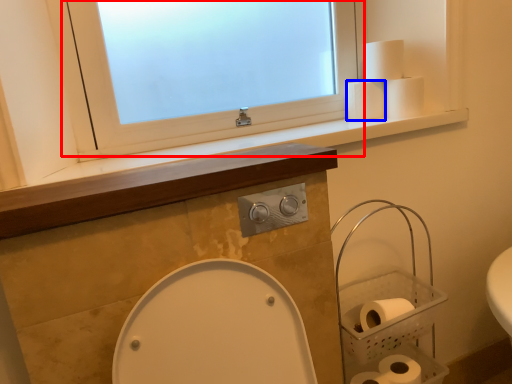
Question: Which object appears farthest to the camera in this image, window (highlighted by a red box) or toilet paper (highlighted by a blue box)?

Choices:
 (A) window
 (B) toilet paper

Answer: (B)